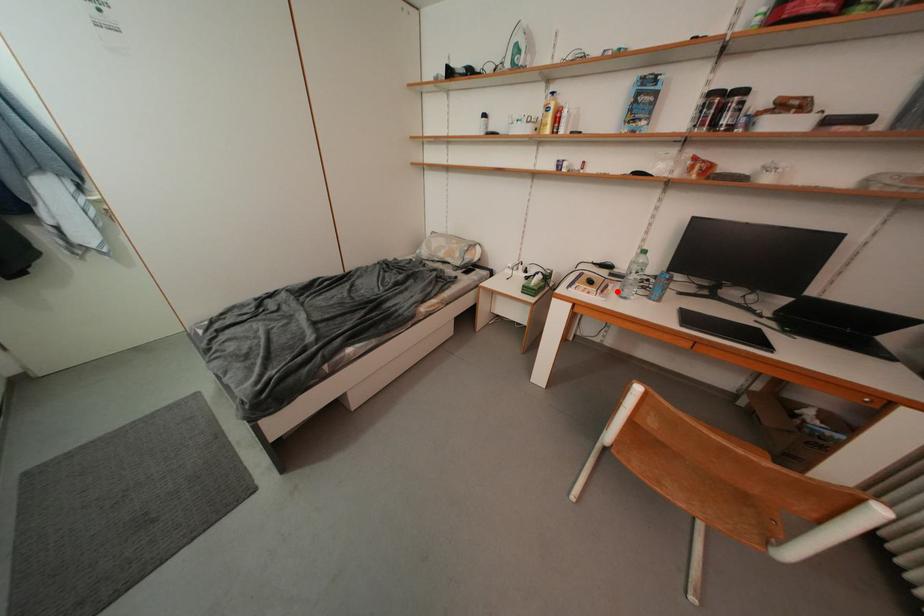
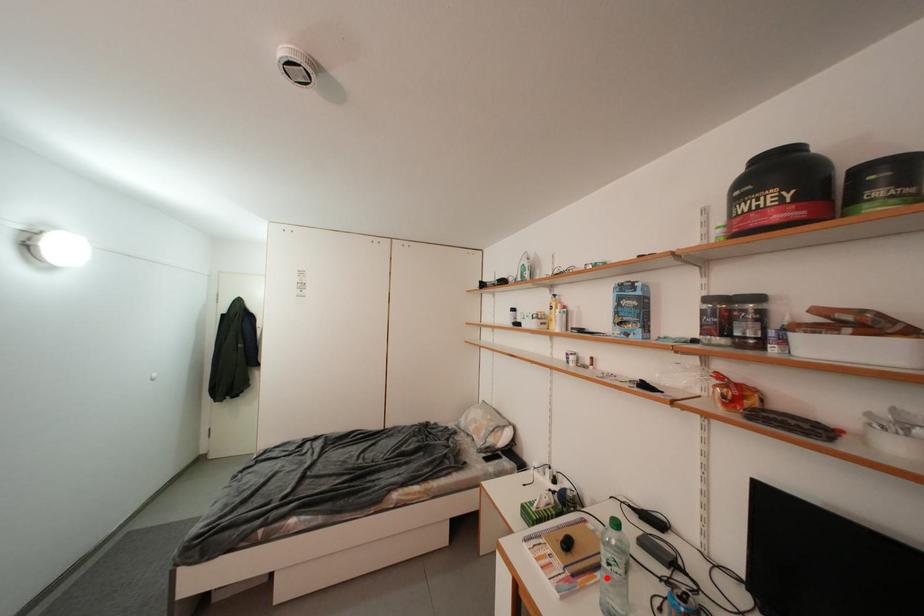
I am providing you with two images of the same scene from different viewpoints. A red point is marked on the first image and another point is marked on the second image. Do the highlighted points in image1 and image2 indicate the same real-world spot?

Yes